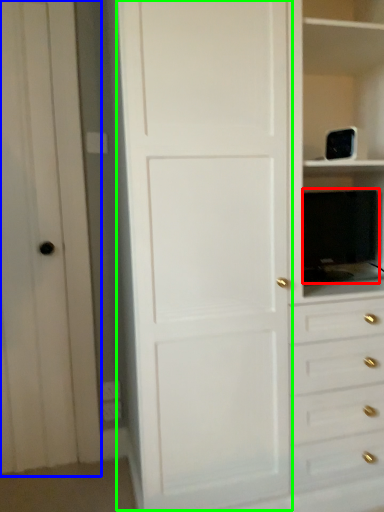
Question: Which object is positioned farthest from appliance (highlighted by a red box)? Select from glass door (highlighted by a blue box) and door (highlighted by a green box).

Choices:
 (A) glass door
 (B) door

Answer: (A)